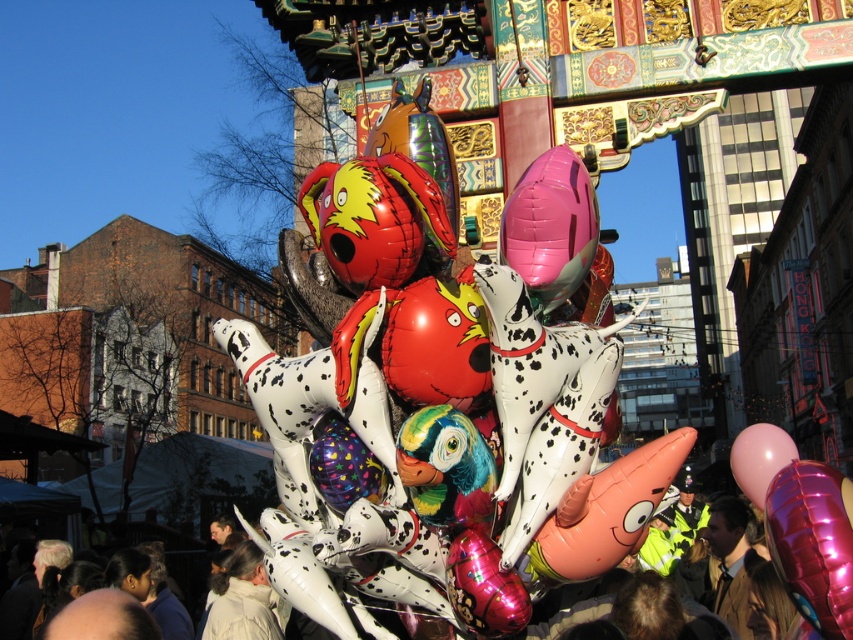
From the picture: Can you confirm if glossy metallic balloon at center is positioned to the left of light beige jacket at lower center?

No, glossy metallic balloon at center is not to the left of light beige jacket at lower center.

Who is more distant from viewer, (846, 605) or (218, 589)?

The point (218, 589) is behind.

Who is more forward, [764,515] or [276,636]?

Point [764,515] is in front.

Identify the location of glossy metallic balloon at center. This screenshot has width=853, height=640. (813, 541).

Does light beige jacket at lower center appear on the right side of brown leather jacket at lower right?

No, light beige jacket at lower center is not to the right of brown leather jacket at lower right.

Can you confirm if light beige jacket at lower center is positioned above brown leather jacket at lower right?

Actually, light beige jacket at lower center is below brown leather jacket at lower right.

What are the coordinates of `light beige jacket at lower center` in the screenshot? It's located at (242, 598).

Image resolution: width=853 pixels, height=640 pixels. Identify the location of light beige jacket at lower center. (242, 598).

Is pink glossy balloon at center wider than pink glossy balloon at right?

Incorrect, pink glossy balloon at center's width does not surpass pink glossy balloon at right's.

How far apart are pink glossy balloon at center and pink glossy balloon at right?

The distance of pink glossy balloon at center from pink glossy balloon at right is 49.84 feet.

At what (x,y) coordinates should I click in order to perform the action: click on pink glossy balloon at center. Please return your answer as a coordinate pair (x, y). Looking at the image, I should click on (550, 227).